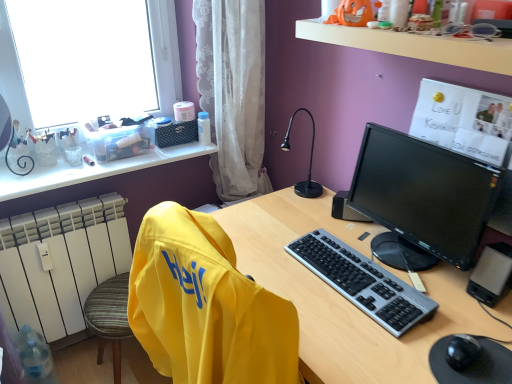
At what (x,y) coordinates should I click in order to perform the action: click on vacant space that's between black rubber mouse at lower right and black plastic keyboard at center. Please return your answer as a coordinate pair (x, y). The image size is (512, 384). Looking at the image, I should click on (435, 330).